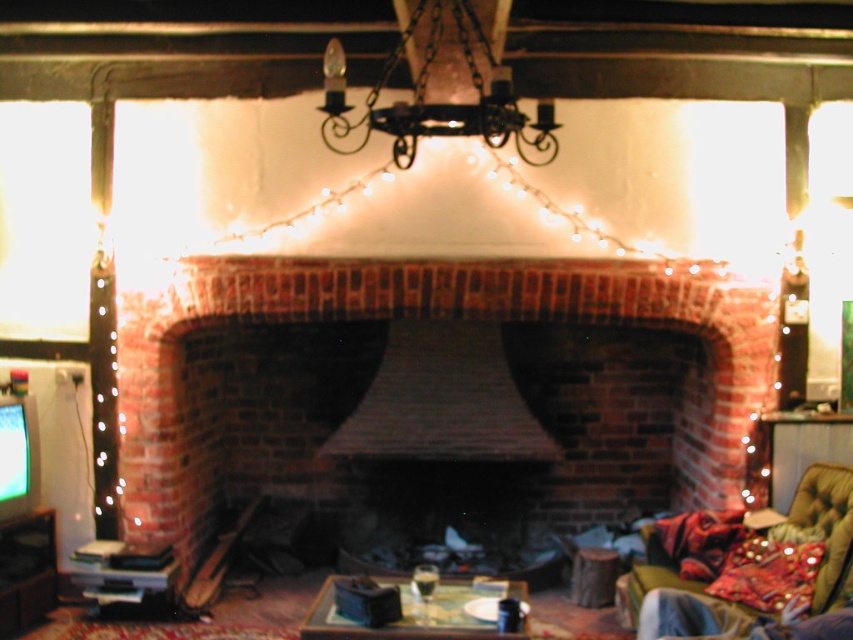
You are a painter who needs to hang a 2 meter long painting between the black wrought iron chandelier at upper center and the velvet green couch at lower right. Is there enough space for the painting?

The distance between the black wrought iron chandelier at upper center and the velvet green couch at lower right is 2.11 meters, so yes, there is enough space to hang a 2 meter long painting between them.

You are standing in the room and see the point marked at coordinates (427, 317). Based on the scene description, can you tell me what object this point is located on?

The point marked at coordinates (427, 317) is located on the brick fireplace at center.

Please provide the coordinates of the brick fireplace at center in the image.

The brick fireplace at center is located at coordinates point (x=427, y=317).